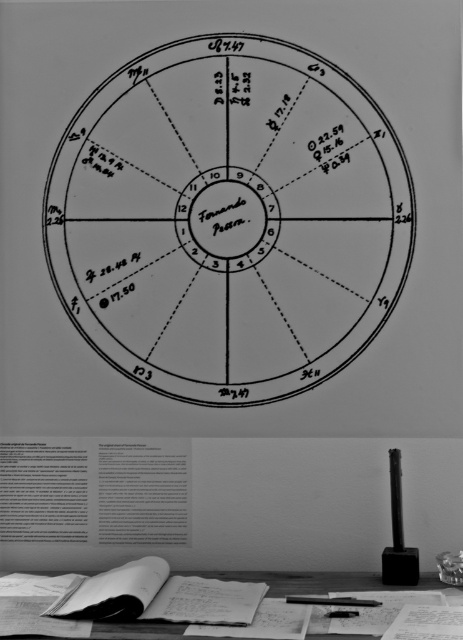
You are an astrologer analyzing Fernando Poza natal chart. You notice the black ink circle at center and the black plastic pen at lower center on the desk. Which object is closer to you from your viewpoint?

The black plastic pen at lower center is behind the black ink circle at center, so the black ink circle at center is closer to you.

You are a student trying to study the astrological chart on the desk. You have a black plastic pen at lower center and a smooth wooden table at lower center. Which object is taller?

The smooth wooden table at lower center is taller than the black plastic pen at lower center.

Looking at this image, you are standing at the edge of the desk and want to place the black plastic pen at lower center onto the smooth wooden table at lower center. Can you directly move the pen to the table without lifting your hand above the desk surface?

The smooth wooden table at lower center is closer to the viewer than the black plastic pen at lower center, so the pen is further away. To move the pen to the table, you would need to reach across the desk surface towards the pen, but since the table is closer, the pen is behind it from your perspective. Therefore, you cannot directly move the pen to the table without lifting your hand above the desk surface to navigate around the table.